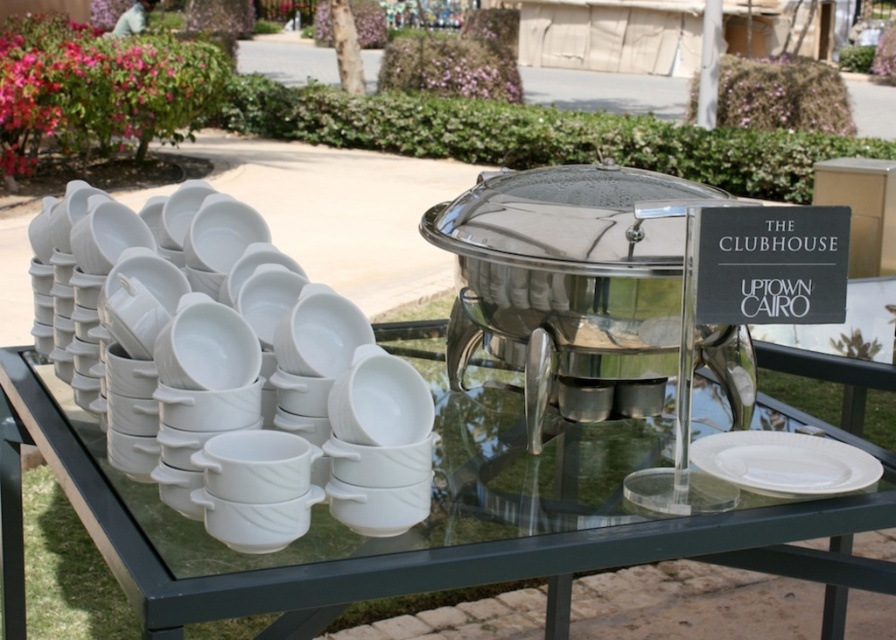
Question: Which point is farther to the camera?

Choices:
 (A) (214, 529)
 (B) (772, 477)
 (C) (856, 564)

Answer: (C)

Question: Can you confirm if white glossy plate at left is positioned to the left of transparent glass table at center?

Choices:
 (A) no
 (B) yes

Answer: (B)

Question: Does white glossy plate at left appear on the right side of white matte plate at center?

Choices:
 (A) no
 (B) yes

Answer: (A)

Question: Based on their relative distances, which object is nearer to the transparent glass table at center?

Choices:
 (A) white matte plate at center
 (B) white glossy plate at left

Answer: (B)

Question: Does white glossy plate at left appear under white matte plate at center?

Choices:
 (A) no
 (B) yes

Answer: (A)

Question: Which point is farther from the camera taking this photo?

Choices:
 (A) (119, 515)
 (B) (386, 440)
 (C) (807, 490)

Answer: (C)